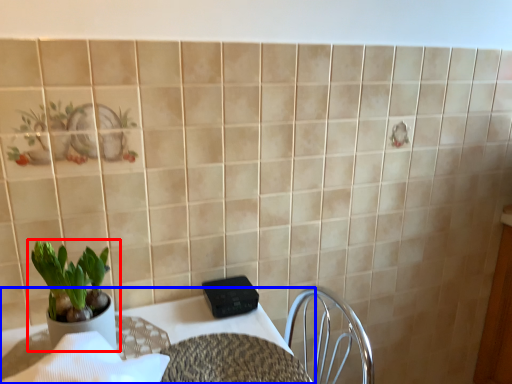
Question: Which object appears closest to the camera in this image, houseplant (highlighted by a red box) or table (highlighted by a blue box)?

Choices:
 (A) houseplant
 (B) table

Answer: (B)